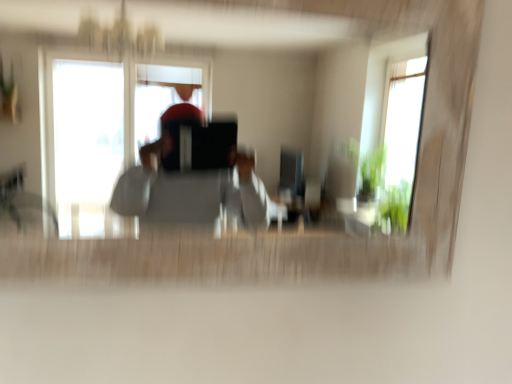
This screenshot has width=512, height=384. I want to click on wooden mirror at center, so click(250, 126).

What is the approximate height of wooden mirror at center?

wooden mirror at center is 21.17 inches tall.

The image size is (512, 384). Describe the element at coordinates (250, 126) in the screenshot. I see `wooden mirror at center` at that location.

What are the coordinates of `wooden mirror at center` in the screenshot? It's located at (250, 126).